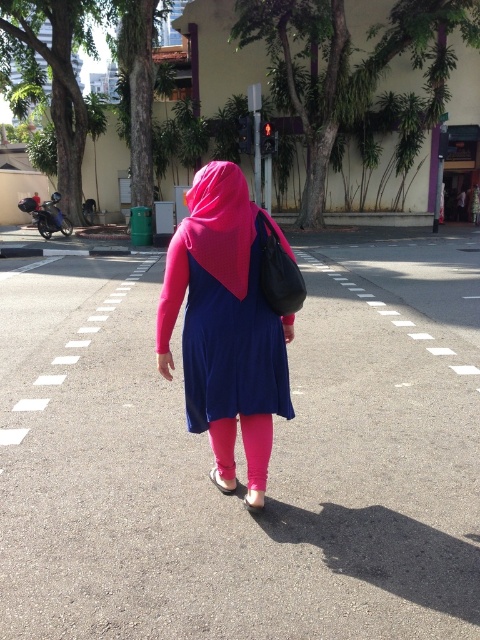
Question: Based on their relative distances, which object is farther from the matte pink dress at center?

Choices:
 (A) pink matte headscarf at center
 (B) matte pink sandal at center
 (C) pink fabric sandal at lower center
 (D) pink fabric pants at center

Answer: (A)

Question: Is matte blue dress at center positioned behind pink fabric sandal at lower center?

Choices:
 (A) yes
 (B) no

Answer: (B)

Question: Which point is closer to the camera?

Choices:
 (A) (222, 349)
 (B) (241, 285)

Answer: (B)

Question: Which of the following is the farthest from the observer?

Choices:
 (A) matte pink dress at center
 (B) pink fabric pants at center
 (C) matte pink sandal at center

Answer: (C)

Question: Does pink matte headscarf at center appear on the right side of pink fabric pants at center?

Choices:
 (A) no
 (B) yes

Answer: (A)

Question: Does pink matte headscarf at center have a lesser width compared to pink fabric pants at center?

Choices:
 (A) yes
 (B) no

Answer: (B)